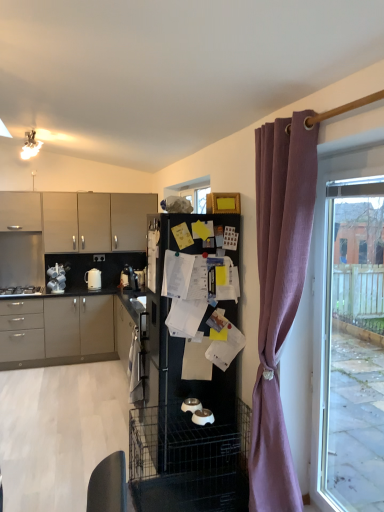
This screenshot has height=512, width=384. Identify the location of mauve fabric curtain at right. (279, 295).

What is the approximate width of white glossy kettle at center?

white glossy kettle at center is 7.65 inches wide.

Where is `mauve fabric curtain at right`? mauve fabric curtain at right is located at coordinates [x=279, y=295].

Measure the distance between matte beige cabinet at upper left, marked as the first cabinetry in a top-to-bottom arrangement, and white glossy kettle at left, the 4th appliance from the bottom.

A distance of 31.15 inches exists between matte beige cabinet at upper left, marked as the first cabinetry in a top-to-bottom arrangement, and white glossy kettle at left, the 4th appliance from the bottom.

Is matte beige cabinet at upper left, marked as the first cabinetry in a top-to-bottom arrangement, positioned behind white glossy kettle at left, the 4th appliance when ordered from right to left?

No, matte beige cabinet at upper left, marked as the first cabinetry in a top-to-bottom arrangement, is closer to the viewer.

From a real-world perspective, starting from the white glossy kettle at left, positioned as the first appliance in top-to-bottom order, which cabinetry is the 2nd one vertically above it? Please provide its 2D coordinates.

[(20, 211)]

Consider the image. Is matte beige cabinet at upper left, marked as the first cabinetry in a top-to-bottom arrangement, beside white glossy kettle at left, acting as the first appliance starting from the left?

matte beige cabinet at upper left, marked as the first cabinetry in a top-to-bottom arrangement, is not next to white glossy kettle at left, acting as the first appliance starting from the left, and they're not touching.

Measure the distance between white glossy pet bowls at center, which ranks as the 1th appliance in bottom-to-top order, and matte gray cabinets at left, arranged as the 3th cabinetry when viewed from the top.

A distance of 3.20 meters exists between white glossy pet bowls at center, which ranks as the 1th appliance in bottom-to-top order, and matte gray cabinets at left, arranged as the 3th cabinetry when viewed from the top.

Which object is further away from the camera, white glossy pet bowls at center, the fourth appliance when ordered from top to bottom, or matte gray cabinets at left, positioned as the first cabinetry in bottom-to-top order?

Positioned behind is matte gray cabinets at left, positioned as the first cabinetry in bottom-to-top order.

From a real-world perspective, is white glossy pet bowls at center, the 4th appliance positioned from the back, on matte gray cabinets at left, arranged as the 3th cabinetry when viewed from the top?

Yes, from a real-world perspective, white glossy pet bowls at center, the 4th appliance positioned from the back, is above matte gray cabinets at left, arranged as the 3th cabinetry when viewed from the top.

In the image, there is a white glossy pet bowls at center, which is the first appliance in front-to-back order. Where is `cabinetry below it (from a real-world perspective)`? Image resolution: width=384 pixels, height=512 pixels. cabinetry below it (from a real-world perspective) is located at coordinates (58, 332).

From the image's perspective, between white glossy bowls at center, the 3th appliance positioned from the back, and white glossy pet bowls at center, the fourth appliance when ordered from top to bottom, who is located below?

white glossy pet bowls at center, the fourth appliance when ordered from top to bottom.

From a real-world perspective, between white glossy bowls at center, acting as the 2th appliance starting from the right, and white glossy pet bowls at center, the fourth appliance when ordered from top to bottom, who is vertically lower?

white glossy pet bowls at center, the fourth appliance when ordered from top to bottom, is physically lower.

Does white glossy bowls at center, marked as the third appliance in a top-to-bottom arrangement, contain white glossy pet bowls at center, which ranks as the 1th appliance in bottom-to-top order?

No, white glossy pet bowls at center, which ranks as the 1th appliance in bottom-to-top order, is located outside of white glossy bowls at center, marked as the third appliance in a top-to-bottom arrangement.

In terms of width, does white glossy bowls at center, the second appliance in the front-to-back sequence, look wider or thinner when compared to white glossy pet bowls at center, acting as the first appliance starting from the right?

In the image, white glossy bowls at center, the second appliance in the front-to-back sequence, appears to be more narrow than white glossy pet bowls at center, acting as the first appliance starting from the right.

Does matte beige cabinet at upper left, the third cabinetry ordered from the bottom, appear on the left side of matte gray cabinets at upper left, the second cabinetry in the bottom-to-top sequence?

Yes, matte beige cabinet at upper left, the third cabinetry ordered from the bottom, is to the left of matte gray cabinets at upper left, the second cabinetry in the bottom-to-top sequence.

From the image's perspective, is matte beige cabinet at upper left, marked as the first cabinetry in a top-to-bottom arrangement, located above or below matte gray cabinets at upper left, the second cabinetry in the bottom-to-top sequence?

From the image's perspective, matte beige cabinet at upper left, marked as the first cabinetry in a top-to-bottom arrangement, appears above matte gray cabinets at upper left, the second cabinetry in the bottom-to-top sequence.

Which point is more forward, (38, 198) or (44, 220)?

The point (38, 198) is closer.

Is matte beige cabinet at upper left, marked as the first cabinetry in a top-to-bottom arrangement, oriented towards matte gray cabinets at upper left, acting as the 2th cabinetry starting from the top?

No, matte beige cabinet at upper left, marked as the first cabinetry in a top-to-bottom arrangement, is not turned towards matte gray cabinets at upper left, acting as the 2th cabinetry starting from the top.

Considering the positions of points (208, 413) and (3, 291), is point (208, 413) closer to camera compared to point (3, 291)?

That is True.

Is white glossy pet bowls at center, which ranks as the 1th appliance in bottom-to-top order, thinner than stainless steel gas stove at left?

Yes.

From a real-world perspective, who is located lower, white glossy pet bowls at center, the fourth appliance in the left-to-right sequence, or stainless steel gas stove at left?

In real-world perspective, white glossy pet bowls at center, the fourth appliance in the left-to-right sequence, is lower.

From the image's perspective, is white glossy kettle at left, positioned as the first appliance in top-to-bottom order, above white glossy kettle at center?

Yes.

In the scene shown: Could you tell me if white glossy kettle at left, acting as the first appliance starting from the left, is facing white glossy kettle at center?

No, white glossy kettle at left, acting as the first appliance starting from the left, is not facing towards white glossy kettle at center.

Which object is positioned more to the right, white glossy kettle at left, positioned as the first appliance in top-to-bottom order, or white glossy kettle at center?

From the viewer's perspective, white glossy kettle at center appears more on the right side.

Is point (357, 298) more distant than point (151, 211)?

No, it is in front of (151, 211).

From their relative heights in the image, would you say clear glass window at right is taller or shorter than matte gray cabinets at upper left, the second cabinetry in the bottom-to-top sequence?

Clearly, clear glass window at right is taller compared to matte gray cabinets at upper left, the second cabinetry in the bottom-to-top sequence.

Does clear glass window at right lie in front of matte gray cabinets at upper left, the second cabinetry in the bottom-to-top sequence?

Yes, clear glass window at right is in front of matte gray cabinets at upper left, the second cabinetry in the bottom-to-top sequence.

Identify the location of cabinetry on the left of white glossy kettle at left, the 4th appliance when ordered from right to left. The height and width of the screenshot is (512, 384). (20, 211).

Which cabinetry is the 1st one when counting from the back of the white glossy pet bowls at center, which ranks as the 1th appliance in bottom-to-top order? Please provide its 2D coordinates.

[(58, 332)]

Consider the image. Based on their spatial positions, is white glossy pet bowls at center, the 4th appliance positioned from the back, or black matte refrigerator at center further from matte gray cabinets at left, positioned as the first cabinetry in bottom-to-top order?

white glossy pet bowls at center, the 4th appliance positioned from the back, is further to matte gray cabinets at left, positioned as the first cabinetry in bottom-to-top order.

Estimate the real-world distances between objects in this image. Which object is closer to stainless steel gas stove at left, matte beige cabinet at upper left, the third cabinetry ordered from the bottom, or white glossy kettle at center?

Based on the image, white glossy kettle at center appears to be nearer to stainless steel gas stove at left.

From the image, which object appears to be farther from matte beige cabinet at upper left, marked as the first cabinetry in a top-to-bottom arrangement, stainless steel gas stove at left or mauve fabric curtain at right?

mauve fabric curtain at right is positioned further to the anchor matte beige cabinet at upper left, marked as the first cabinetry in a top-to-bottom arrangement.

Which object lies nearer to the anchor point white glossy kettle at left, the 4th appliance when ordered from right to left, matte gray cabinets at upper left, the second cabinetry in the bottom-to-top sequence, or stainless steel gas stove at left?

stainless steel gas stove at left lies closer to white glossy kettle at left, the 4th appliance when ordered from right to left, than the other object.

Which object lies further to the anchor point matte gray cabinets at left, arranged as the 3th cabinetry when viewed from the top, stainless steel gas stove at left or white glossy pet bowls at center, the 4th appliance positioned from the back?

The object further to matte gray cabinets at left, arranged as the 3th cabinetry when viewed from the top, is white glossy pet bowls at center, the 4th appliance positioned from the back.

Estimate the real-world distances between objects in this image. Which object is closer to white glossy kettle at left, the 4th appliance when ordered from right to left, white glossy kettle at center or matte gray cabinets at upper left, the second cabinetry in the bottom-to-top sequence?

white glossy kettle at center.

From the image, which object appears to be nearer to white glossy kettle at left, which is the 3th appliance from bottom to top, white glossy kettle at center or matte gray cabinets at upper left, acting as the 2th cabinetry starting from the top?

The object closer to white glossy kettle at left, which is the 3th appliance from bottom to top, is white glossy kettle at center.

Considering their positions, is matte gray cabinets at left, positioned as the first cabinetry in bottom-to-top order, positioned further to white glossy bowls at center, acting as the 2th appliance starting from the right, than white glossy kettle at left, the 1th appliance positioned from the back?

white glossy kettle at left, the 1th appliance positioned from the back, lies further to white glossy bowls at center, acting as the 2th appliance starting from the right, than the other object.

Where is `refrigerator between white glossy pet bowls at center, acting as the first appliance starting from the right, and white glossy kettle at center, along the z-axis`? This screenshot has height=512, width=384. refrigerator between white glossy pet bowls at center, acting as the first appliance starting from the right, and white glossy kettle at center, along the z-axis is located at coordinates (181, 403).

The image size is (384, 512). Find the location of `appliance between stainless steel gas stove at left and matte gray cabinets at upper left, acting as the 2th cabinetry starting from the top, in the horizontal direction`. appliance between stainless steel gas stove at left and matte gray cabinets at upper left, acting as the 2th cabinetry starting from the top, in the horizontal direction is located at coordinates (57, 278).

At what (x,y) coordinates should I click in order to perform the action: click on gas stove between black matte refrigerator at center and white glossy kettle at left, the 4th appliance when ordered from right to left, along the z-axis. Please return your answer as a coordinate pair (x, y). The height and width of the screenshot is (512, 384). Looking at the image, I should click on (21, 290).

The height and width of the screenshot is (512, 384). In order to click on appliance positioned between mauve fabric curtain at right and black matte refrigerator at center from near to far in this screenshot , I will do pos(203,417).